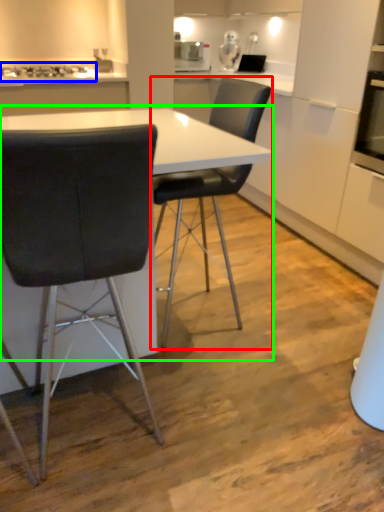
Question: Which is nearer to the chair (highlighted by a red box)? gas stove (highlighted by a blue box) or table (highlighted by a green box).

Choices:
 (A) gas stove
 (B) table

Answer: (B)